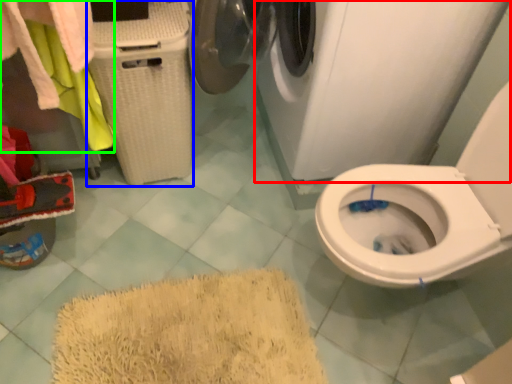
Question: Which object is positioned farthest from washing machine (highlighted by a red box)? Select from laundry basket (highlighted by a blue box) and laundry (highlighted by a green box).

Choices:
 (A) laundry basket
 (B) laundry

Answer: (B)